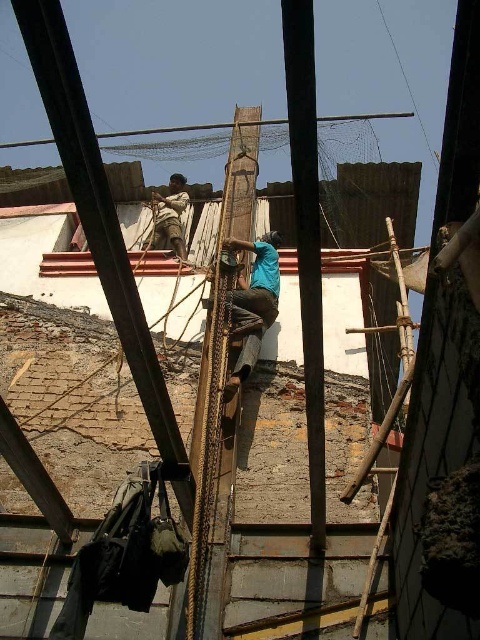
You are a construction worker who needs to move a 30 feet long metal beam from the smooth wood pole at center to the bamboo ladder at center. Can you safely move it without bending the beam?

The distance between the smooth wood pole at center and the bamboo ladder at center is 28.95 feet. Since the metal beam is 30 feet long, it cannot be moved safely without bending as the distance is shorter than the beam.

From the picture: You are a safety inspector observing the construction site. You notice the smooth wood pole at center and the bamboo ladder at center. According to safety protocols, which object should be visible without obstruction to ensure safety?

The smooth wood pole at center is in front of the bamboo ladder at center. Therefore, the bamboo ladder at center is partially obstructed. To ensure safety, the bamboo ladder at center should be visible without obstruction, so it needs to be repositioned or the pole moved.